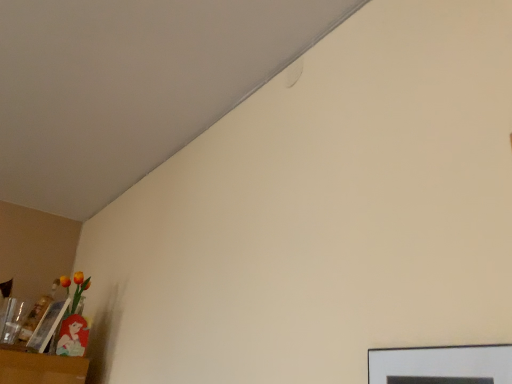
Question: Is matte plastic picture frame at lower left, acting as the first picture frame starting from the left, surrounding matte black picture frame at lower right, which is the first picture frame from front to back?

Choices:
 (A) no
 (B) yes

Answer: (A)

Question: Considering the relative sizes of matte plastic picture frame at lower left, which is the 1th picture frame from back to front, and matte black picture frame at lower right, placed as the 2th picture frame when sorted from bottom to top, in the image provided, is matte plastic picture frame at lower left, which is the 1th picture frame from back to front, shorter than matte black picture frame at lower right, placed as the 2th picture frame when sorted from bottom to top,?

Choices:
 (A) yes
 (B) no

Answer: (B)

Question: Is matte plastic picture frame at lower left, the first picture frame when ordered from bottom to top, with matte black picture frame at lower right, placed as the 2th picture frame when sorted from bottom to top?

Choices:
 (A) yes
 (B) no

Answer: (B)

Question: Is matte plastic picture frame at lower left, which is the 1th picture frame from back to front, to the left of matte black picture frame at lower right, which appears as the 2th picture frame when viewed from the left, from the viewer's perspective?

Choices:
 (A) no
 (B) yes

Answer: (B)

Question: From a real-world perspective, is matte plastic picture frame at lower left, which is the 1th picture frame from back to front, below matte black picture frame at lower right, placed as the 2th picture frame when sorted from bottom to top?

Choices:
 (A) yes
 (B) no

Answer: (B)

Question: Does matte plastic picture frame at lower left, acting as the first picture frame starting from the left, have a lesser width compared to matte black picture frame at lower right, which appears as the 2th picture frame when viewed from the left?

Choices:
 (A) no
 (B) yes

Answer: (A)

Question: From the image's perspective, is matte black picture frame at lower right, which is the first picture frame from front to back, located beneath matte plastic picture frame at lower left, which is the second picture frame in top-to-bottom order?

Choices:
 (A) yes
 (B) no

Answer: (B)

Question: Can you confirm if matte black picture frame at lower right, marked as the second picture frame in a back-to-front arrangement, is smaller than matte plastic picture frame at lower left, which is the 1th picture frame from back to front?

Choices:
 (A) yes
 (B) no

Answer: (A)

Question: Is matte black picture frame at lower right, which is the first picture frame from front to back, in front of matte plastic picture frame at lower left, which is the 2th picture frame in front-to-back order?

Choices:
 (A) no
 (B) yes

Answer: (B)

Question: Is matte plastic picture frame at lower left, which is the 1th picture frame from back to front, a part of matte black picture frame at lower right, the 1th picture frame in the top-to-bottom sequence?

Choices:
 (A) no
 (B) yes

Answer: (A)

Question: Considering the relative sizes of matte black picture frame at lower right, placed as the 2th picture frame when sorted from bottom to top, and matte plastic picture frame at lower left, which is the 1th picture frame from back to front, in the image provided, is matte black picture frame at lower right, placed as the 2th picture frame when sorted from bottom to top, thinner than matte plastic picture frame at lower left, which is the 1th picture frame from back to front,?

Choices:
 (A) yes
 (B) no

Answer: (A)

Question: From the image's perspective, is matte black picture frame at lower right, which is the first picture frame from front to back, located above matte plastic picture frame at lower left, which is the 2th picture frame in front-to-back order?

Choices:
 (A) yes
 (B) no

Answer: (A)

Question: In terms of size, does matte black picture frame at lower right, which appears as the 2th picture frame when viewed from the left, appear bigger or smaller than matte plastic picture frame at lower left, which is the 1th picture frame from back to front?

Choices:
 (A) big
 (B) small

Answer: (B)